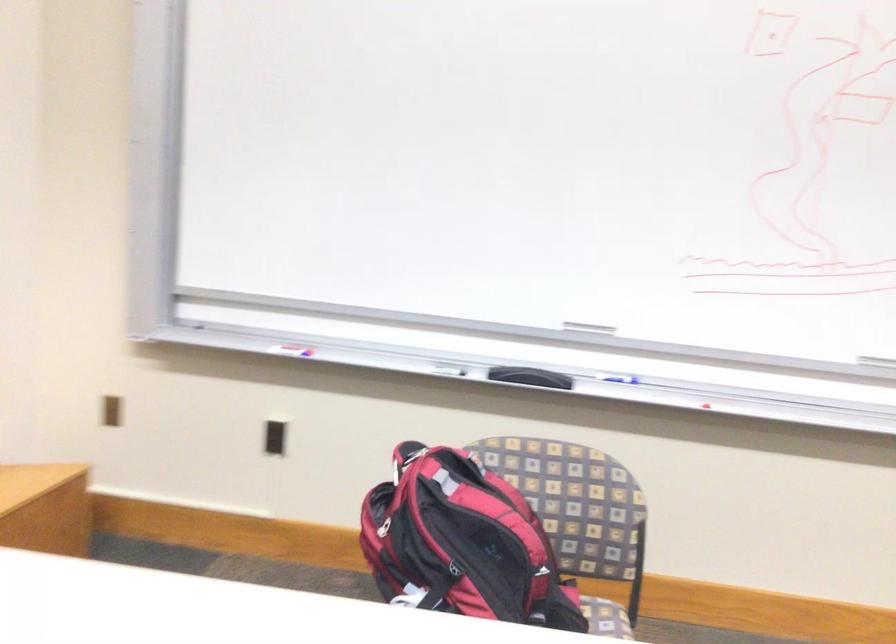
Locate an element on the screen. Image resolution: width=896 pixels, height=644 pixels. red whiteboard marker is located at coordinates (288, 345).